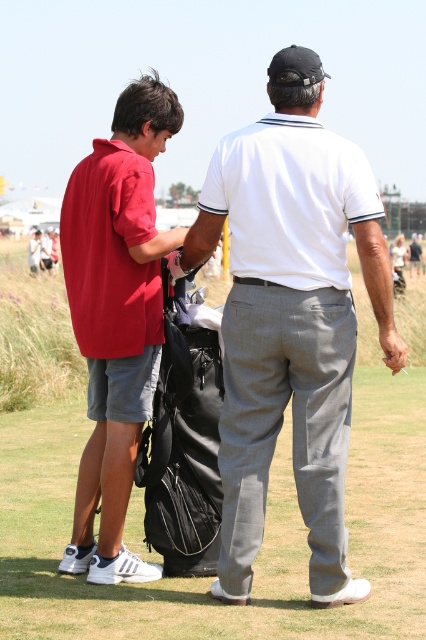
You are a photographer trying to capture a photo of the matte red polo shirt at left and the black fabric golf bag at center. Which object should you focus on first if you want to include both in your frame?

The matte red polo shirt at left is positioned on the left side of black fabric golf bag at center, so you should focus on the matte red polo shirt at left first to ensure both are in frame.

You are a photographer trying to capture a clear shot of both the white cotton polo shirt at center and the black fabric golf bag at center. Since the golf bag is lower, will you need to adjust your camera angle upwards or downwards to include both in the frame?

The white cotton polo shirt at center is above the black fabric golf bag at center. To include both in the frame, you should adjust your camera angle downward to capture the lower position of the golf bag while still including the polo shirt above.

You are a photographer trying to capture a clear shot of both the white cotton polo shirt at center and the black fabric golf bag at center. Which object should you focus on first if you want to ensure both are in frame without moving the camera?

The white cotton polo shirt at center is larger in size than the black fabric golf bag at center, so you should focus on the white cotton polo shirt at center first to ensure it fits within the frame before adjusting for the smaller black fabric golf bag at center.